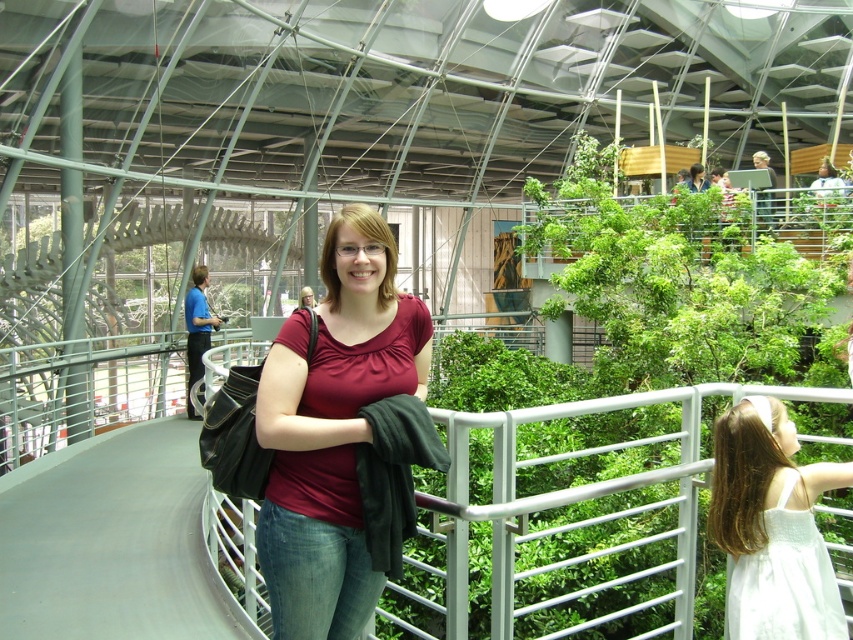
You are a fashion designer observing the indoor botanical garden scene. You notice the matte red blouse at center and the white satin dress at lower right. Which clothing item has a greater width?

The matte red blouse at center has a greater width than the white satin dress at lower right.

You are a fashion designer observing the indoor botanical garden scene. You notice two red garments at the center of the image. Which one is closer to the camera, the matte red blouse at center or the matte red shirt at center?

Both the matte red blouse at center and matte red shirt at center are positioned at the same distance from the camera since they are both at the center of the image.